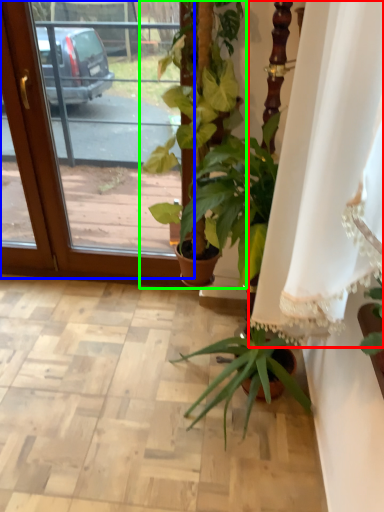
Question: Which is farther away from curtain (highlighted by a red box)? screen door (highlighted by a blue box) or houseplant (highlighted by a green box)?

Choices:
 (A) screen door
 (B) houseplant

Answer: (A)